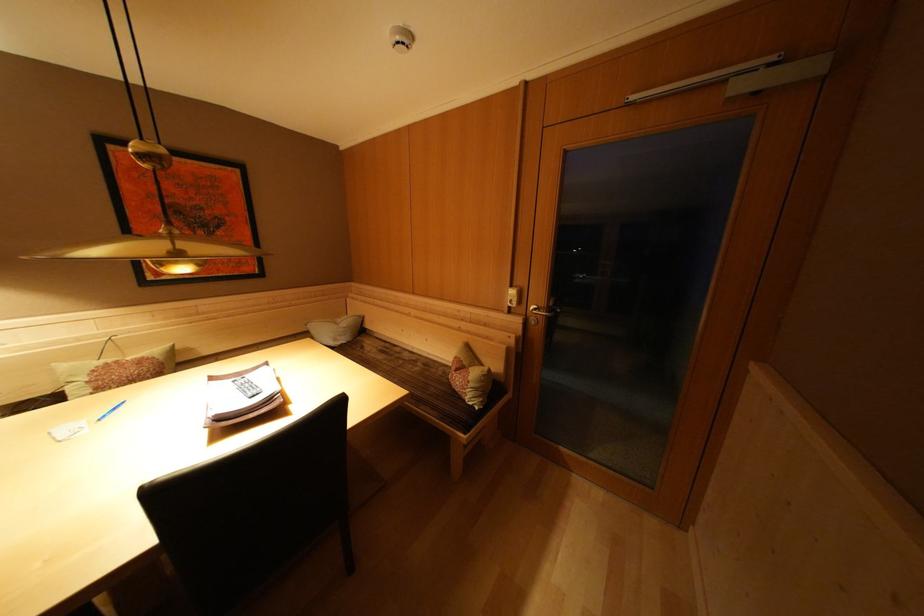
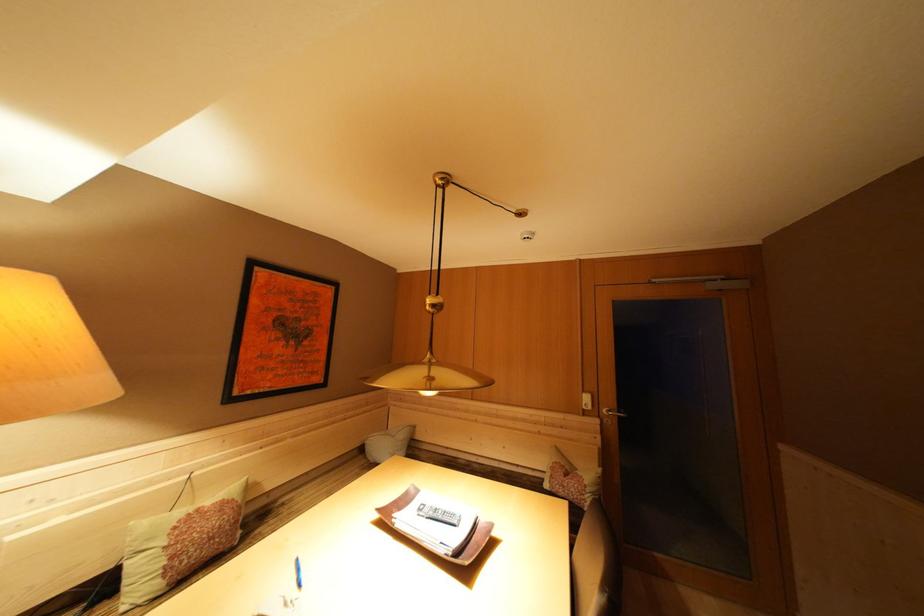
The point at (518, 291) is marked in the first image. Where is the corresponding point in the second image?

(590, 397)